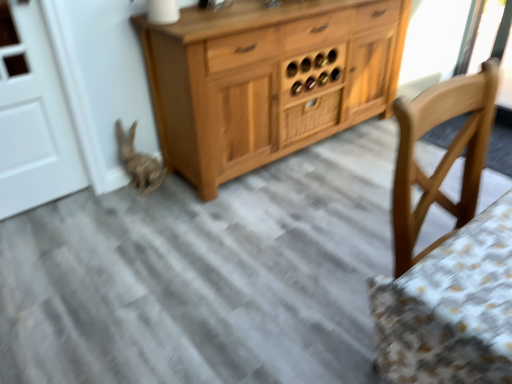
Question: In the image, is bleached wood rabbit at lower left positioned in front of or behind wooden drawer at center?

Choices:
 (A) behind
 (B) front

Answer: (B)

Question: Is point (151, 168) closer or farther from the camera than point (335, 109)?

Choices:
 (A) farther
 (B) closer

Answer: (B)

Question: From a real-world perspective, is bleached wood rabbit at lower left positioned above or below wooden drawer at center?

Choices:
 (A) below
 (B) above

Answer: (A)

Question: Visually, is wooden drawer at center positioned to the left or to the right of bleached wood rabbit at lower left?

Choices:
 (A) left
 (B) right

Answer: (B)

Question: Is point (305, 125) positioned closer to the camera than point (126, 147)?

Choices:
 (A) farther
 (B) closer

Answer: (A)

Question: Based on their sizes in the image, would you say wooden drawer at center is bigger or smaller than bleached wood rabbit at lower left?

Choices:
 (A) big
 (B) small

Answer: (B)

Question: From the image's perspective, is wooden drawer at center positioned above or below bleached wood rabbit at lower left?

Choices:
 (A) above
 (B) below

Answer: (A)